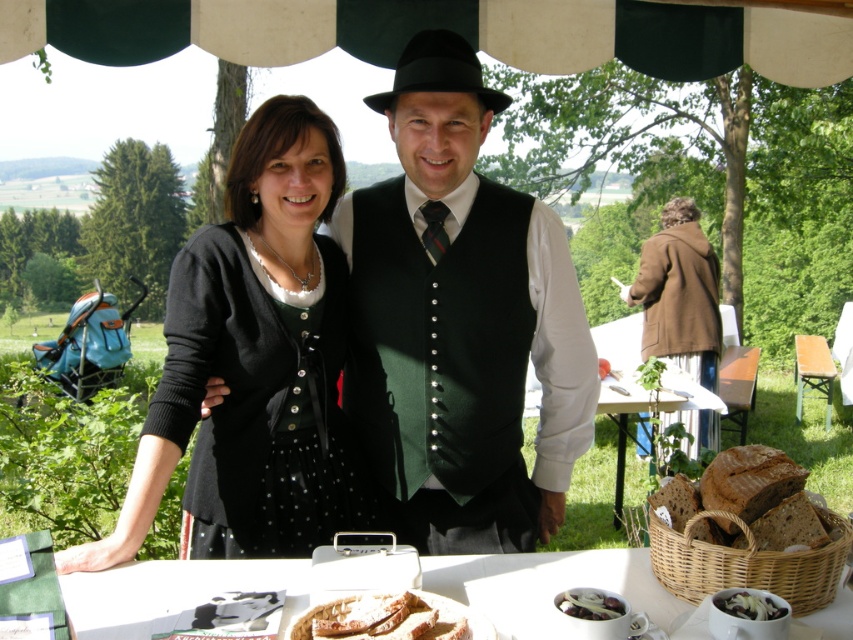
You are a photographer setting up a shot of the scene. You need to ensure that the green fabric vest at center and the white creamy cheese at lower right are both visible in the frame. Based on their positions, which object should you focus on first to capture both in the frame?

The green fabric vest at center is above the white creamy cheese at lower right, so you should focus on the green fabric vest at center first to ensure both are in the frame.

You are at a fair and see a table under a green and white striped canopy. There is a black matte cardigan at center. A point is marked at coordinates (253, 362). Can you determine if this point is located on the black matte cardigan at center?

Yes, the point (253, 362) is on the black matte cardigan at center according to the description.

You are a photographer setting up for an event and need to position a camera so that both the green fabric vest at center and the white creamy cheese at lower right are visible in the frame. Based on their positions, which object should you ensure is closer to the camera to include both in the shot?

The white creamy cheese at lower right is behind the green fabric vest at center, so you should ensure the green fabric vest at center is closer to the camera to avoid blocking the white creamy cheese at lower right.